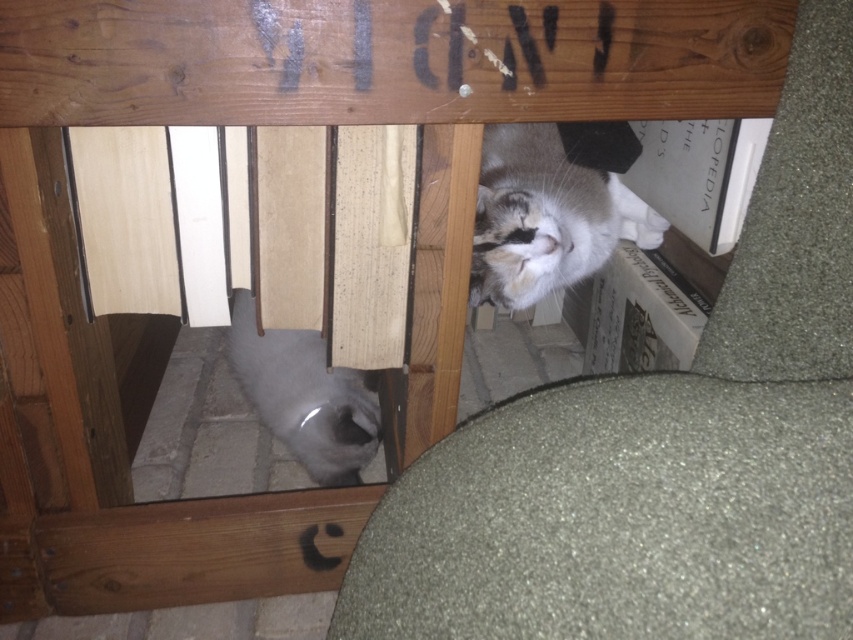
Can you confirm if white fur cat at upper right is shorter than gray fur cat at lower left?

Correct, white fur cat at upper right is not as tall as gray fur cat at lower left.

Does point (531, 179) come in front of point (331, 424)?

No, it is not.

Does point (527, 216) lie in front of point (236, 294)?

Yes, it is.

Find the location of `white fur cat at upper right`. white fur cat at upper right is located at coordinates (546, 218).

Between point (387, 621) and point (480, 211), which one is positioned behind?

The point (480, 211) is behind.

Does soft gray cat at center lie in front of white fur cat at upper right?

Yes, it is.

You are a GUI agent. You are given a task and a screenshot of the screen. Output one action in this format:
    pyautogui.click(x=<x>, y=<y>)
    Task: Click on the soft gray cat at center
    
    Given the screenshot: What is the action you would take?
    pyautogui.click(x=662, y=445)

Can you confirm if soft gray cat at center is taller than gray fur cat at lower left?

Yes.

Who is shorter, soft gray cat at center or gray fur cat at lower left?

With less height is gray fur cat at lower left.

Where is `soft gray cat at center`? Image resolution: width=853 pixels, height=640 pixels. soft gray cat at center is located at coordinates (662, 445).